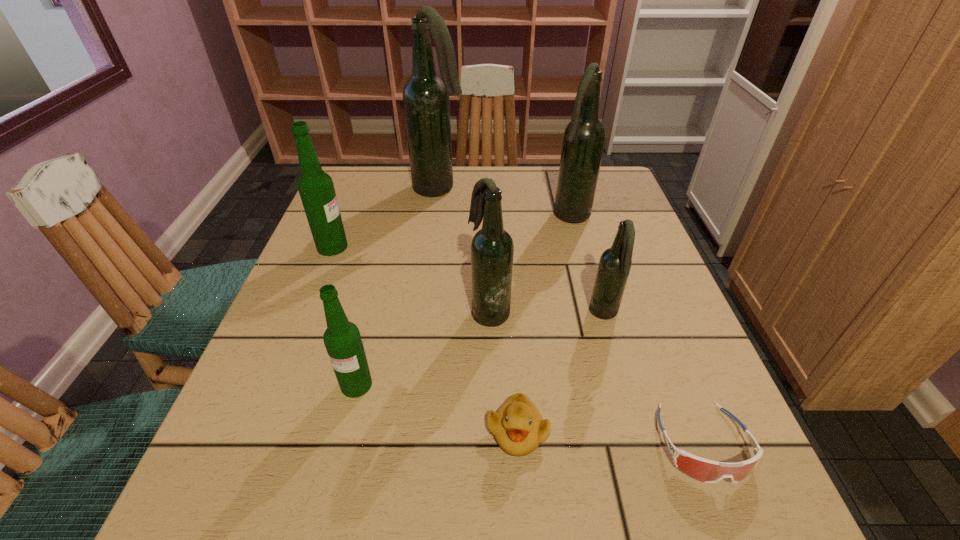
Image resolution: width=960 pixels, height=540 pixels. What are the coordinates of `object that is the second closest to the fifth nearest beer bottle` in the screenshot? It's located at (615, 263).

This screenshot has width=960, height=540. I want to click on the fourth closest beer bottle to the fifth nearest beer bottle, so click(x=316, y=188).

This screenshot has width=960, height=540. Identify the location of beer bottle that is the fifth nearest to the second farthest dark beer bottle. (342, 339).

This screenshot has height=540, width=960. I want to click on dark beer bottle that stands as the closest to the second farthest object, so click(x=426, y=102).

Point out which dark beer bottle is positioned as the nearest to the shortest object. Please provide its 2D coordinates. Your answer should be formatted as a tuple, i.e. [(x, y)], where the tuple contains the x and y coordinates of a point satisfying the conditions above.

[(615, 263)]

What are the coordinates of `vacant region that satisfies the following two spatial constraints: 1. on the back side of the third biggest dark beer bottle; 2. on the label of the farther green beer bottle` in the screenshot? It's located at (488, 247).